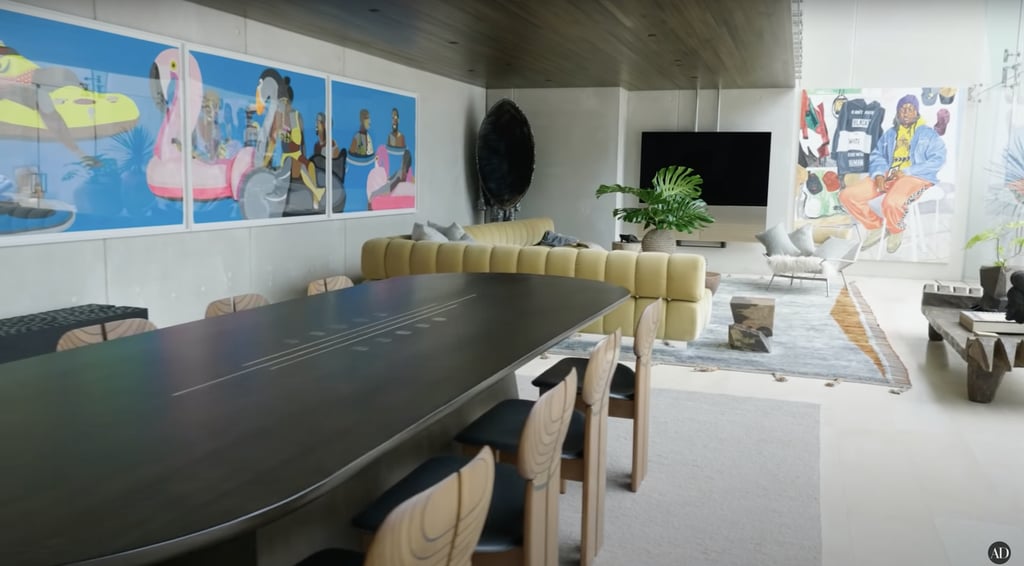
Where is `low wooden celling`? low wooden celling is located at coordinates [x=601, y=38].